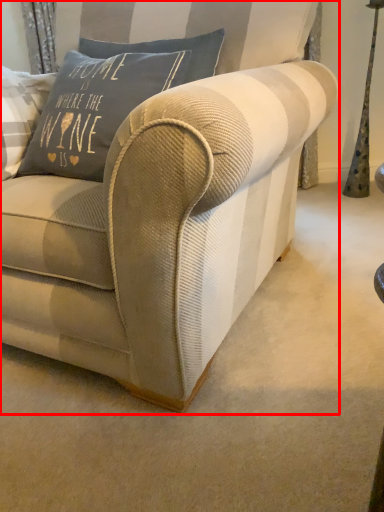
Question: In this image, where is studio couch (annotated by the red box) located relative to pillow?

Choices:
 (A) left
 (B) right

Answer: (B)